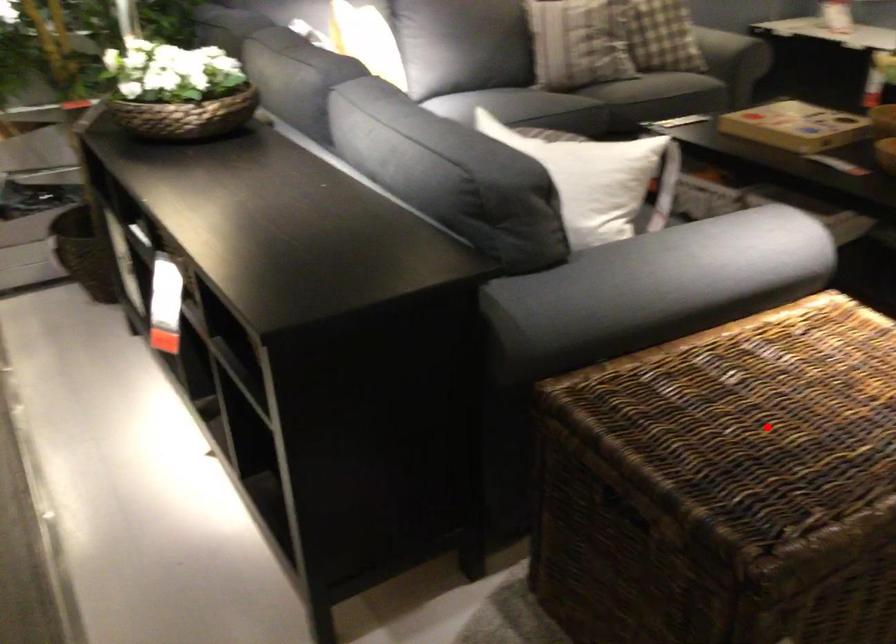
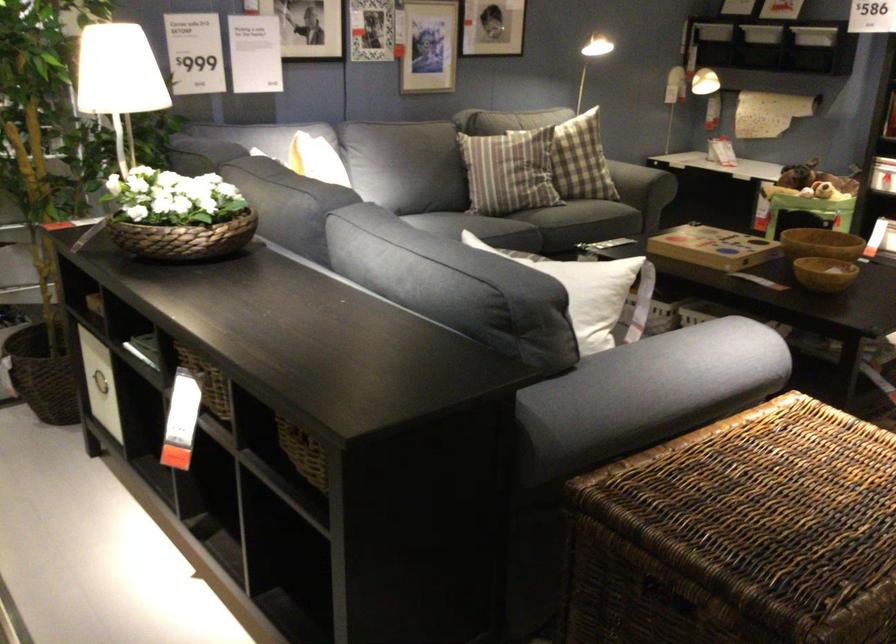
Locate, in the second image, the point that corresponds to the highlighted location in the first image.

(776, 509)